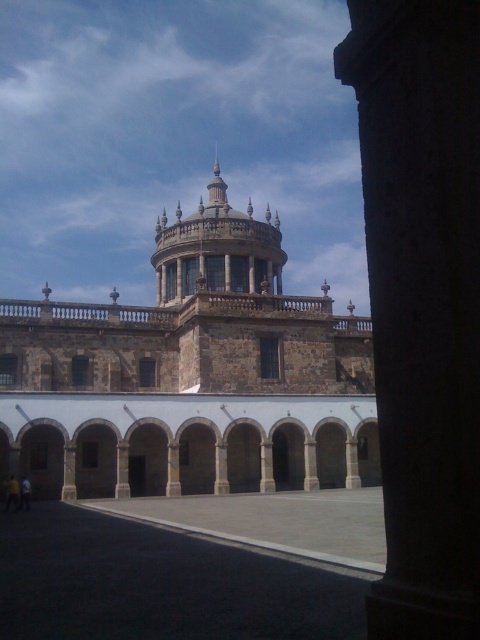
In the scene shown: You are standing at the entrance of the building and want to take a photo of the stone dome at center. According to the coordinates provided, where should you position yourself to capture the dome in the center of your camera frame?

The stone dome at center is located at coordinates point (190, 376), so positioning yourself at the entrance facing towards the dome should allow you to center it in your camera frame.

You are an architect planning to add a new sculpture between the stone dome at center and the brown stone tower at center. Given their sizes, which one should the sculpture be placed closer to for visual balance?

The stone dome at center is larger in size than the brown stone tower at center, so the sculpture should be placed closer to the brown stone tower at center to balance the visual weight.